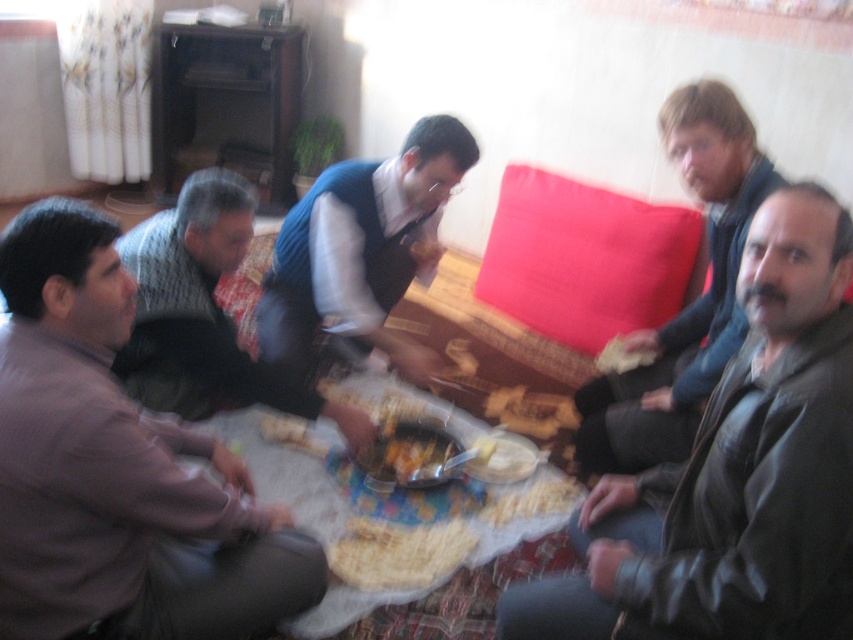
Question: Which object is closer to the camera taking this photo?

Choices:
 (A) blue knitted sweater at center
 (B) knitted sweater at lower left
 (C) leather jacket at lower right

Answer: (C)

Question: Which point appears farthest from the camera in this image?

Choices:
 (A) (428, 483)
 (B) (618, 365)

Answer: (B)

Question: Can you confirm if blue knitted sweater at center is thinner than yellowish matte bread at center?

Choices:
 (A) no
 (B) yes

Answer: (A)

Question: Is blue knitted sweater at center wider than yellowish matte bread at center?

Choices:
 (A) yes
 (B) no

Answer: (A)

Question: Does smooth plastic cup at center come in front of yellowish matte bread at center?

Choices:
 (A) yes
 (B) no

Answer: (A)

Question: Estimate the real-world distances between objects in this image. Which object is farther from the brown textured shirt at left?

Choices:
 (A) dark brown leather jacket at right
 (B) yellowish matte bread at center
 (C) yellow butter at center
 (D) knitted sweater at lower left

Answer: (B)